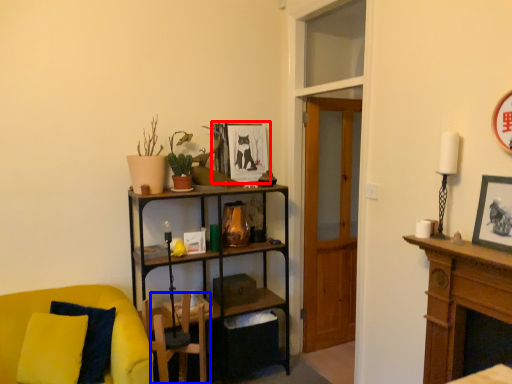
Question: Which object appears farthest to the camera in this image, picture frame (highlighted by a red box) or swivel chair (highlighted by a blue box)?

Choices:
 (A) picture frame
 (B) swivel chair

Answer: (A)